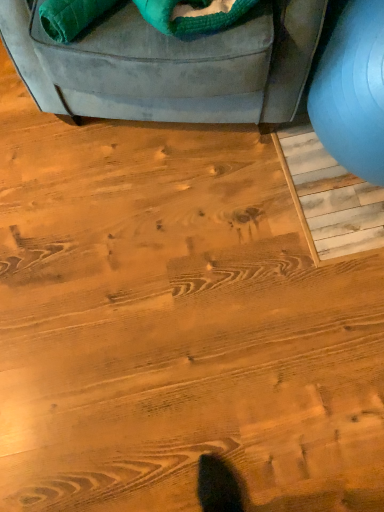
Find the location of `matte blue exercise ball at right`. matte blue exercise ball at right is located at coordinates (352, 91).

Based on the photo, what is the approximate height of matte blue exercise ball at right?

It is 22.87 inches.

What do you see at coordinates (352, 91) in the screenshot? The height and width of the screenshot is (512, 384). I see `matte blue exercise ball at right` at bounding box center [352, 91].

Find the location of a particular element. matte blue exercise ball at right is located at coordinates (352, 91).